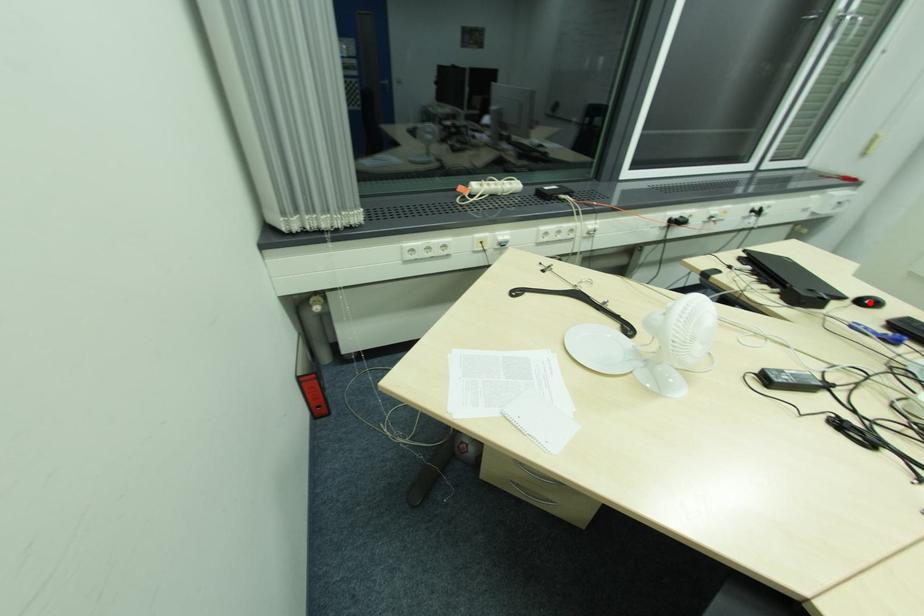
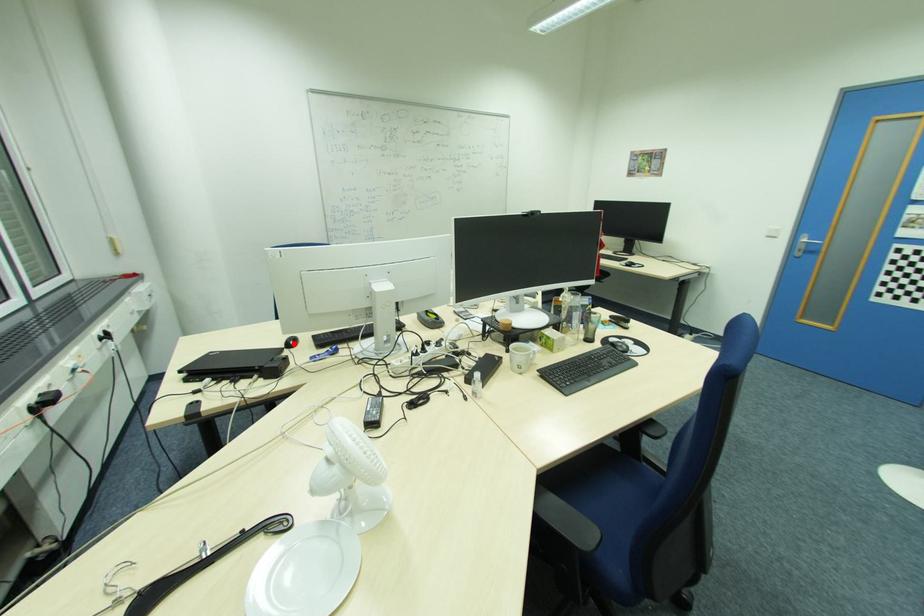
I am providing you with two images of the same scene from different viewpoints. A red point is marked on the first image and another point is marked on the second image. Do the highlighted points in image1 and image2 indicate the same real-world spot?

Yes